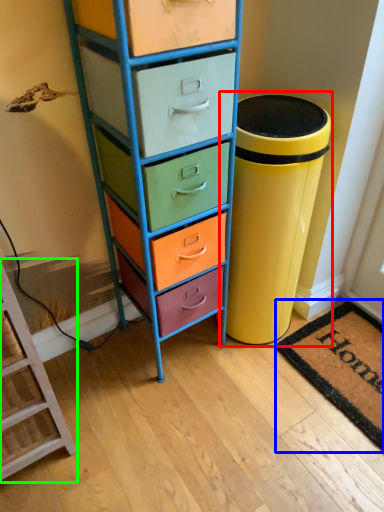
Question: Which object is positioned farthest from waste container (highlighted by a red box)? Select from mat (highlighted by a blue box) and furniture (highlighted by a green box).

Choices:
 (A) mat
 (B) furniture

Answer: (B)